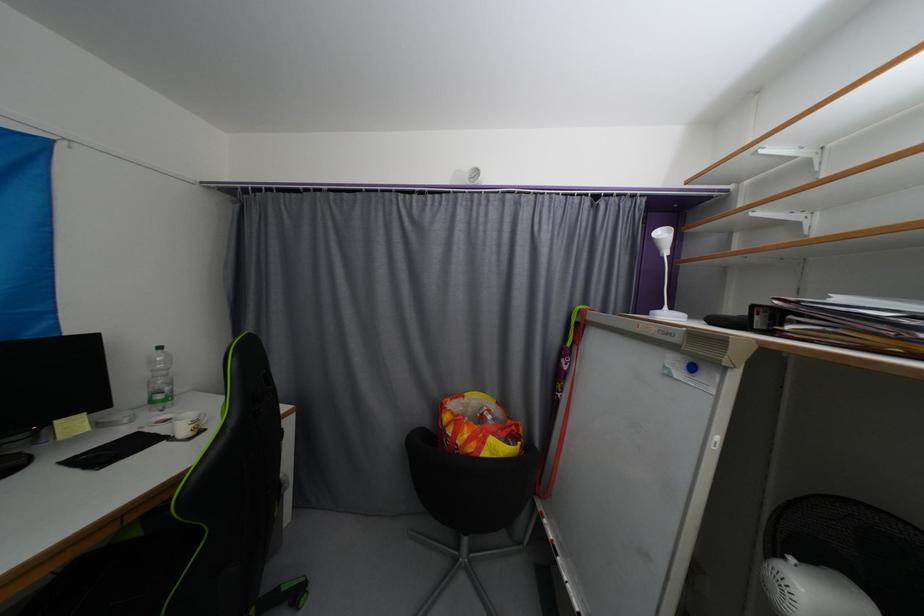
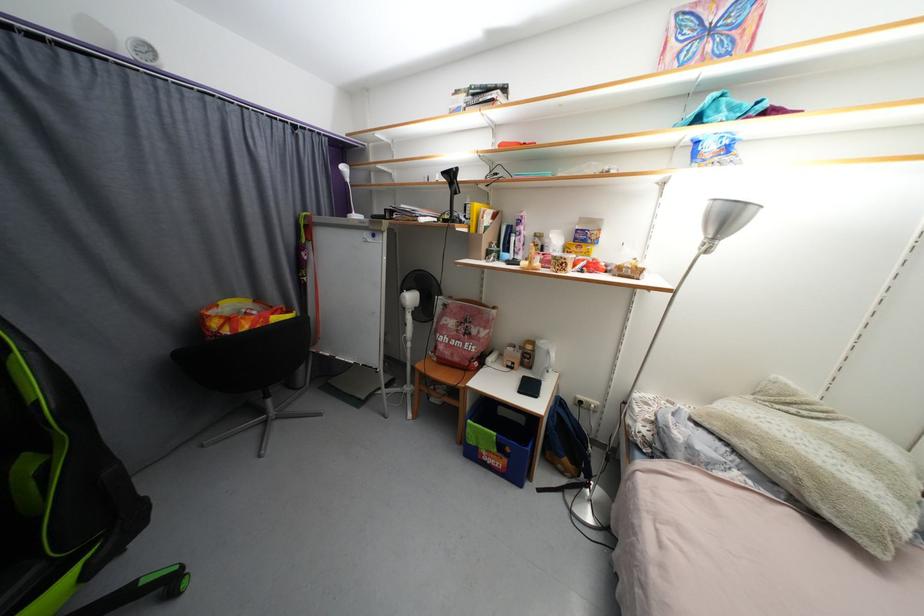
Find the pixel in the second image that matches point 672,317 in the first image.

(360, 217)